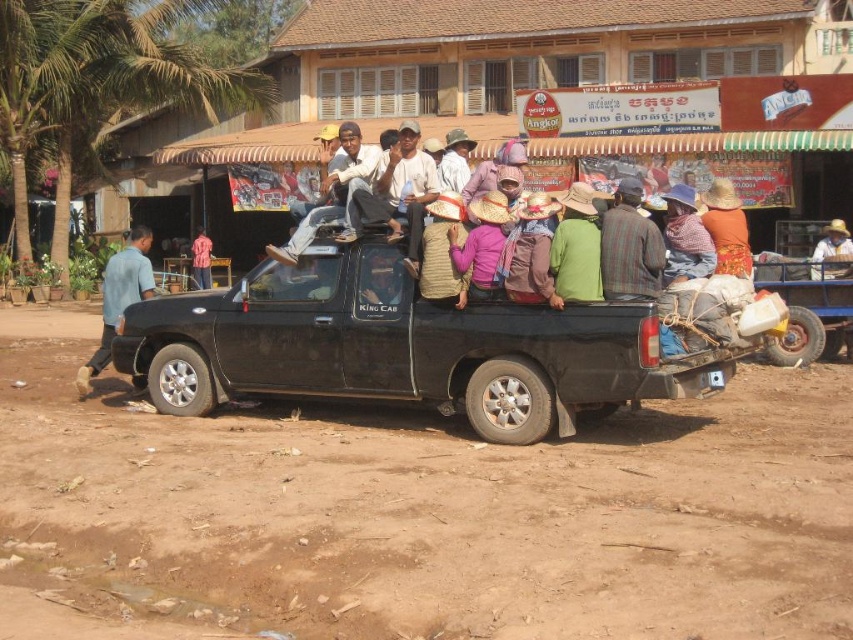
Which is in front, point (77, 467) or point (497, 412)?

Point (77, 467) is in front.

Locate an element on the screen. The width and height of the screenshot is (853, 640). dirt field at lower center is located at coordinates (450, 509).

Does point (173, 417) come behind point (328, 312)?

Yes.

Identify the location of dirt field at lower center. (450, 509).

Is point (346, 291) farther from camera compared to point (108, 275)?

No, it is in front of (108, 275).

Which of these two, black matte truck at center or blue cotton shirt at left, stands taller?

blue cotton shirt at left is taller.

This screenshot has width=853, height=640. I want to click on black matte truck at center, so click(x=405, y=346).

Where is `black matte truck at center`? Image resolution: width=853 pixels, height=640 pixels. black matte truck at center is located at coordinates (405, 346).

How far apart are black matte truck at center and red shirt at center?

black matte truck at center is 41.85 feet from red shirt at center.

How far apart are black matte truck at center and red shirt at center?

The distance of black matte truck at center from red shirt at center is 12.76 meters.

Is point (454, 396) less distant than point (202, 264)?

Yes, point (454, 396) is closer to viewer.

Find the location of `black matte truck at center`. black matte truck at center is located at coordinates (405, 346).